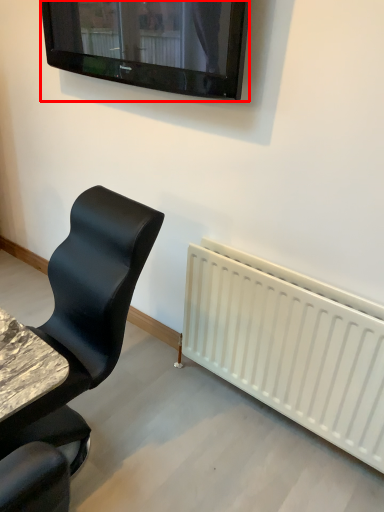
Question: In this image, where is television (annotated by the red box) located relative to chair?

Choices:
 (A) right
 (B) left

Answer: (A)